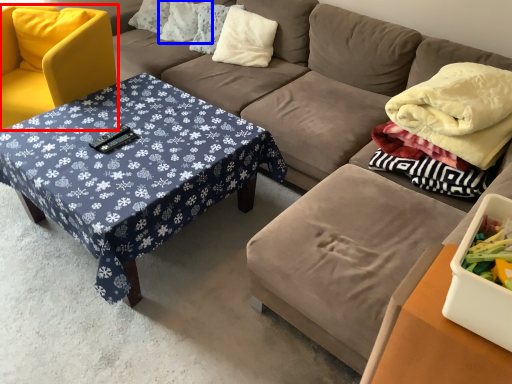
Question: Which of the following is the closest to the observer, chair (highlighted by a red box) or pillow (highlighted by a blue box)?

Choices:
 (A) chair
 (B) pillow

Answer: (A)